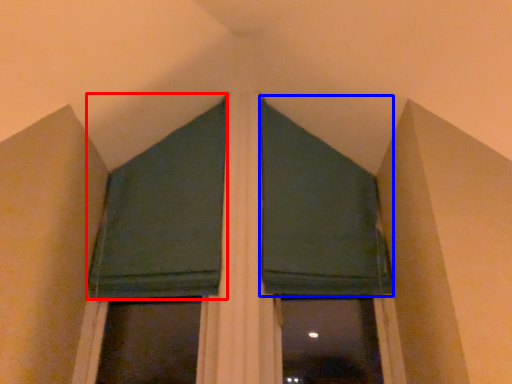
Question: Which of the following is the farthest to the observer, curtain (highlighted by a red box) or curtain (highlighted by a blue box)?

Choices:
 (A) curtain
 (B) curtain

Answer: (B)